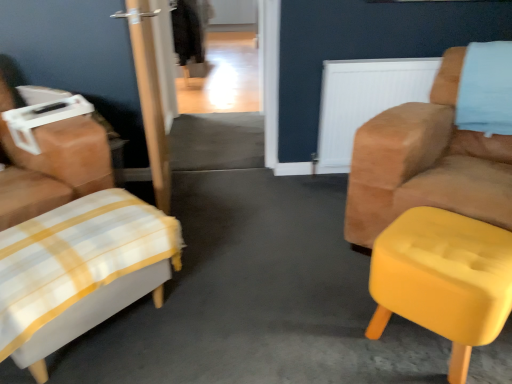
The width and height of the screenshot is (512, 384). Find the location of `free space above yellow fabric ottoman at right, arranged as the second furniture when viewed from the left (from a real-world perspective)`. free space above yellow fabric ottoman at right, arranged as the second furniture when viewed from the left (from a real-world perspective) is located at coordinates (439, 244).